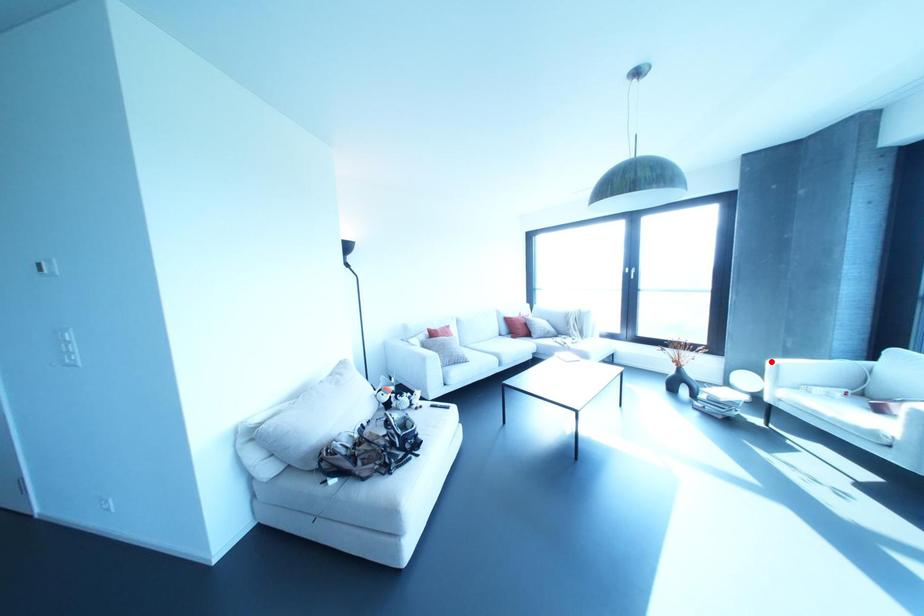
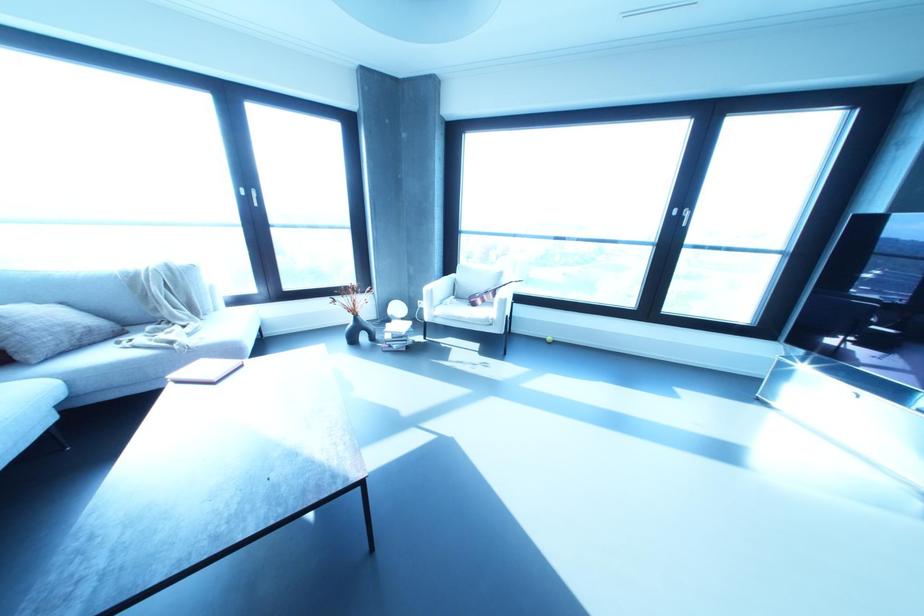
The point at the highlighted location is marked in the first image. Where is the corresponding point in the second image?

(426, 288)